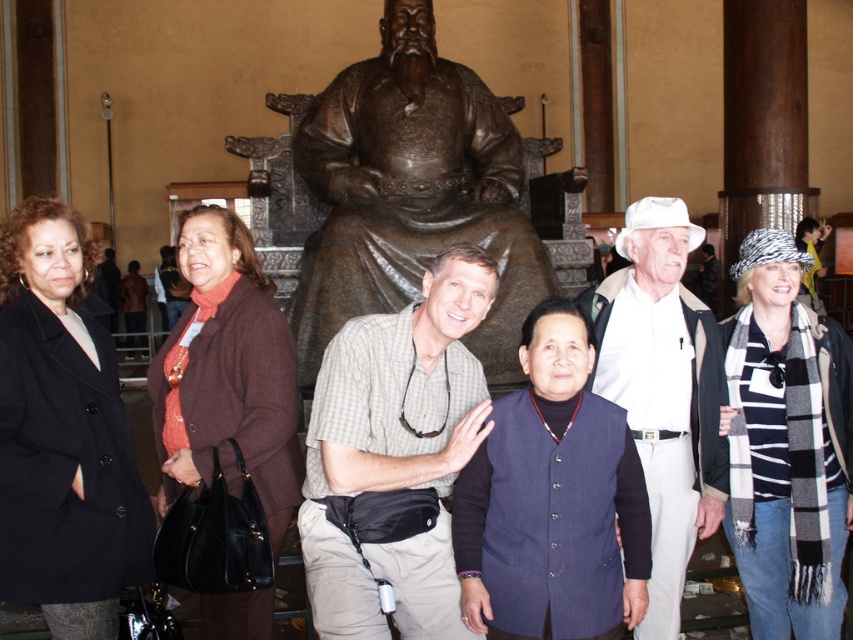
Question: Can you confirm if checkered fabric shirt at center is positioned above white cotton hat at center?

Choices:
 (A) no
 (B) yes

Answer: (A)

Question: Can you confirm if bronze statue at center is positioned to the right of white cotton hat at center?

Choices:
 (A) no
 (B) yes

Answer: (A)

Question: Which object appears closest to the camera in this image?

Choices:
 (A) bronze statue at center
 (B) checkered fabric shirt at center
 (C) white cotton hat at center

Answer: (B)

Question: Considering the relative positions of checkered fabric shirt at center and white cotton hat at center in the image provided, where is checkered fabric shirt at center located with respect to white cotton hat at center?

Choices:
 (A) below
 (B) above

Answer: (A)

Question: Which of the following is the farthest from the observer?

Choices:
 (A) white cotton hat at center
 (B) bronze statue at center
 (C) checkered fabric shirt at center

Answer: (B)

Question: Which object is closer to the camera taking this photo?

Choices:
 (A) bronze statue at center
 (B) white cotton hat at center

Answer: (B)